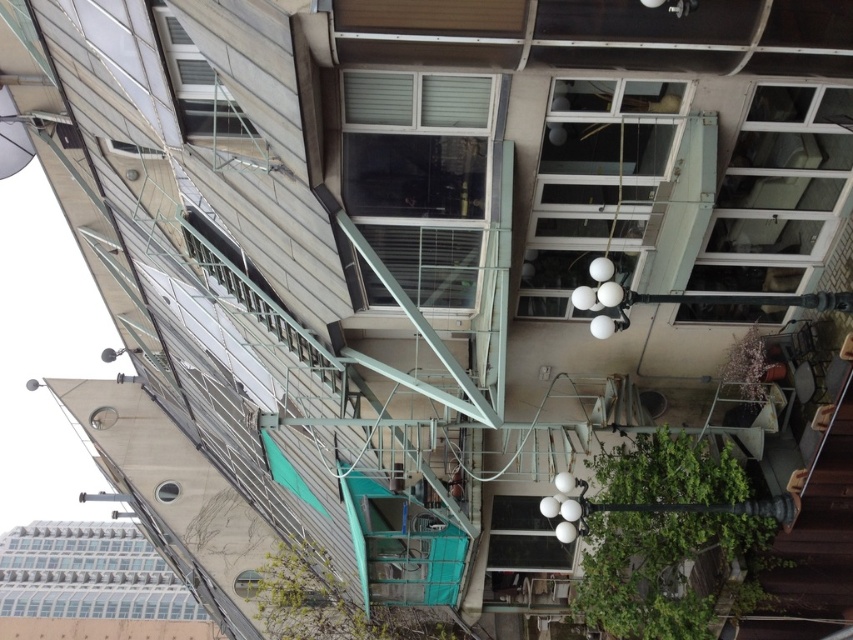
Measure the distance between point (842, 616) and camera.

Point (842, 616) is 25.23 meters away from camera.

Which is more to the right, wooden at right or green matte plant at lower right?

wooden at right

Based on the photo, who is more distant from viewer, [757,625] or [733,362]?

Positioned behind is point [757,625].

You are a GUI agent. You are given a task and a screenshot of the screen. Output one action in this format:
    pyautogui.click(x=<x>, y=<y>)
    Task: Click on the wooden at right
    The image size is (853, 640).
    Given the screenshot: What is the action you would take?
    pyautogui.click(x=815, y=541)

Who is lower down, green leafy plant at lower right or wooden at right?

Positioned lower is green leafy plant at lower right.

Does green leafy plant at lower right have a smaller size compared to wooden at right?

No.

Image resolution: width=853 pixels, height=640 pixels. Identify the location of green leafy plant at lower right. (663, 532).

This screenshot has width=853, height=640. Identify the location of green leafy plant at lower right. (663, 532).

Is green leafy plant at lower right positioned at the back of green leafy plant at lower center?

No, it is not.

In the scene shown: Does green leafy plant at lower right have a lesser height compared to green leafy plant at lower center?

Correct, green leafy plant at lower right is not as tall as green leafy plant at lower center.

Which is behind, point (605, 580) or point (312, 560)?

Positioned behind is point (312, 560).

The height and width of the screenshot is (640, 853). Identify the location of green leafy plant at lower right. (663, 532).